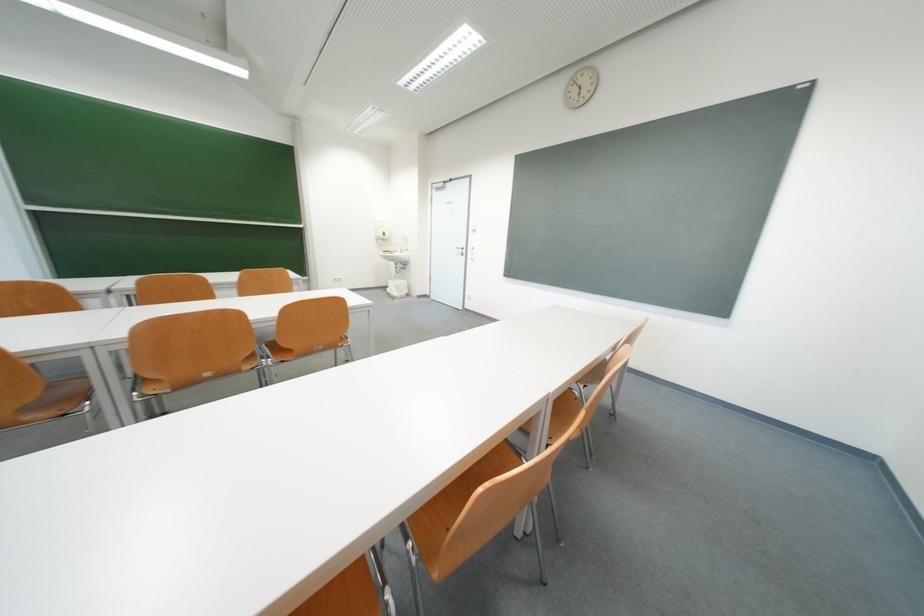
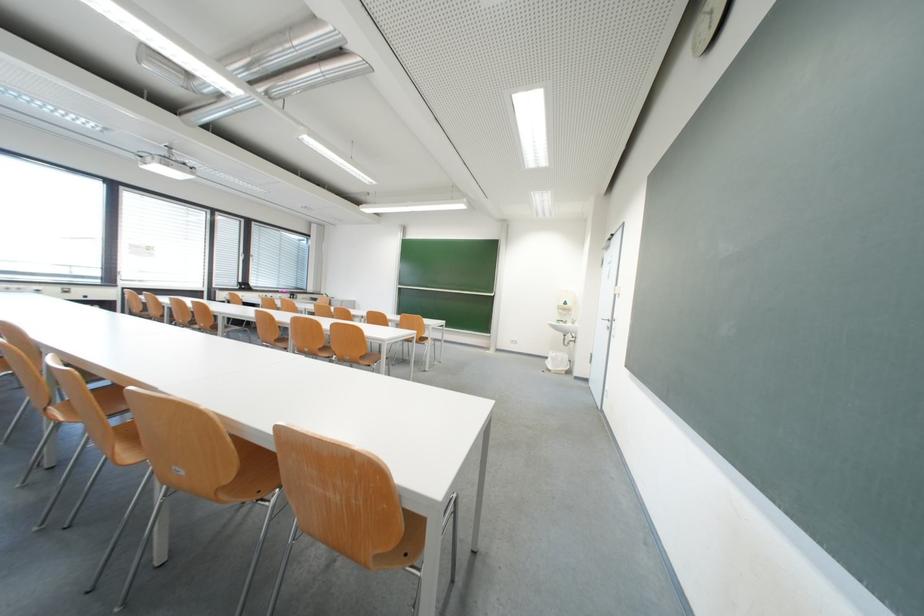
Where in the second image is the point corresponding to [396,256] from the first image?

(570, 326)